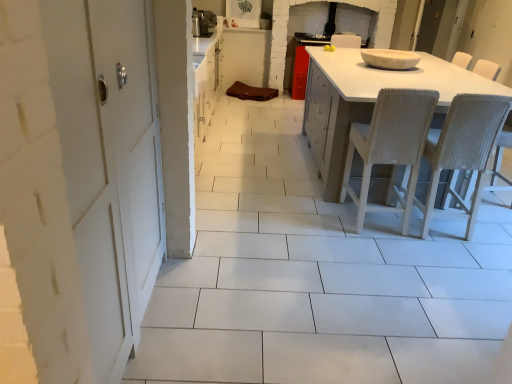
Question: From the image's perspective, is brown fabric at center on white glossy bowl at center, the first appliance in the right-to-left sequence?

Choices:
 (A) no
 (B) yes

Answer: (B)

Question: Is brown fabric at center behind white glossy bowl at center, which ranks as the second appliance in top-to-bottom order?

Choices:
 (A) no
 (B) yes

Answer: (B)

Question: Considering the relative sizes of brown fabric at center and white glossy bowl at center, the second appliance when ordered from back to front, in the image provided, is brown fabric at center bigger than white glossy bowl at center, the second appliance when ordered from back to front,?

Choices:
 (A) no
 (B) yes

Answer: (B)

Question: Does brown fabric at center appear on the right side of white glossy bowl at center, the second appliance when ordered from back to front?

Choices:
 (A) yes
 (B) no

Answer: (B)

Question: Does brown fabric at center have a greater width compared to white glossy bowl at center, the first appliance in the right-to-left sequence?

Choices:
 (A) no
 (B) yes

Answer: (B)

Question: Is brown fabric at center thinner than white glossy bowl at center, which is the 2th appliance from left to right?

Choices:
 (A) no
 (B) yes

Answer: (A)

Question: Is woven wood chair at center, which appears as the 1th chair when viewed from the left, behind white matte table at right?

Choices:
 (A) no
 (B) yes

Answer: (A)

Question: Would you say woven wood chair at center, the second chair viewed from the right, is outside white matte table at right?

Choices:
 (A) yes
 (B) no

Answer: (B)

Question: Considering the relative sizes of woven wood chair at center, which appears as the 1th chair when viewed from the left, and white matte table at right in the image provided, is woven wood chair at center, which appears as the 1th chair when viewed from the left, smaller than white matte table at right?

Choices:
 (A) yes
 (B) no

Answer: (A)

Question: Is woven wood chair at center, the second chair viewed from the right, positioned in front of white matte table at right?

Choices:
 (A) no
 (B) yes

Answer: (B)

Question: Are woven wood chair at center, the second chair viewed from the right, and white matte table at right located far from each other?

Choices:
 (A) no
 (B) yes

Answer: (A)

Question: Is woven wood chair at center, which appears as the 1th chair when viewed from the left, next to white matte table at right?

Choices:
 (A) yes
 (B) no

Answer: (B)

Question: Considering the relative sizes of white glossy bowl at center, the second appliance when ordered from back to front, and white matte table at right in the image provided, is white glossy bowl at center, the second appliance when ordered from back to front, thinner than white matte table at right?

Choices:
 (A) no
 (B) yes

Answer: (B)